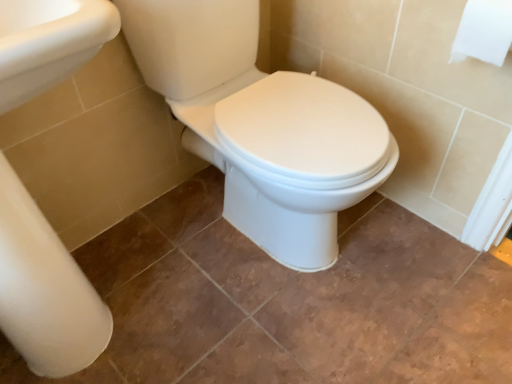
Question: Considering the relative positions of white glossy porcelain at center and white paper at upper right in the image provided, is white glossy porcelain at center to the left or to the right of white paper at upper right?

Choices:
 (A) left
 (B) right

Answer: (A)

Question: Based on their sizes in the image, would you say white glossy porcelain at center is bigger or smaller than white paper at upper right?

Choices:
 (A) big
 (B) small

Answer: (A)

Question: From the image's perspective, is white glossy porcelain at center positioned above or below white paper at upper right?

Choices:
 (A) below
 (B) above

Answer: (A)

Question: From the image's perspective, is white paper at upper right located above or below white glossy porcelain at center?

Choices:
 (A) below
 (B) above

Answer: (B)

Question: Is white paper at upper right inside or outside of white glossy porcelain at center?

Choices:
 (A) outside
 (B) inside

Answer: (A)

Question: Looking at their shapes, would you say white paper at upper right is wider or thinner than white glossy porcelain at center?

Choices:
 (A) thin
 (B) wide

Answer: (A)

Question: Relative to white glossy porcelain at center, is white paper at upper right in front or behind?

Choices:
 (A) front
 (B) behind

Answer: (B)